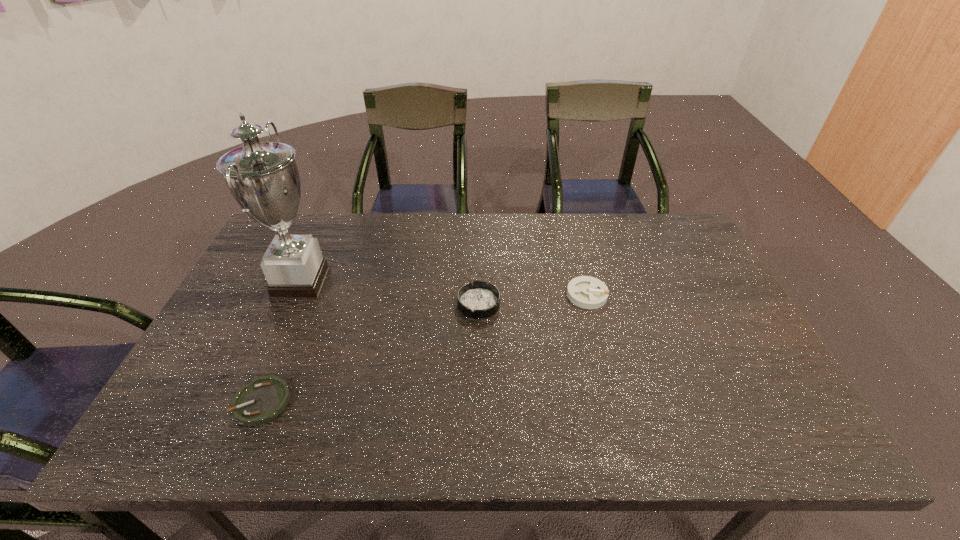
You are a GUI agent. You are given a task and a screenshot of the screen. Output one action in this format:
    pyautogui.click(x=<x>, y=<y>)
    Task: Click on the object positioned at the near edge
    
    Given the screenshot: What is the action you would take?
    pyautogui.click(x=262, y=400)

Where is `trophy cup located in the left edge section of the desktop`? Image resolution: width=960 pixels, height=540 pixels. trophy cup located in the left edge section of the desktop is located at coordinates (263, 178).

I want to click on ashtray at the left edge, so click(262, 400).

Where is `object located at the far left corner`? object located at the far left corner is located at coordinates (263, 178).

Find the location of a particular element. This screenshot has width=960, height=540. object situated at the near left corner is located at coordinates click(262, 400).

In the image, there is a desktop. Where is `vacant space at the far edge`? The height and width of the screenshot is (540, 960). vacant space at the far edge is located at coordinates (394, 222).

Where is `vacant space at the near edge of the desktop`? vacant space at the near edge of the desktop is located at coordinates (528, 413).

This screenshot has height=540, width=960. Find the location of `vacant space at the left edge of the desktop`. vacant space at the left edge of the desktop is located at coordinates (226, 410).

This screenshot has height=540, width=960. Find the location of `free space at the near right corner`. free space at the near right corner is located at coordinates (727, 417).

Where is `vacant area that lies between the second ashtray from left to right and the rightmost object`? This screenshot has width=960, height=540. vacant area that lies between the second ashtray from left to right and the rightmost object is located at coordinates (533, 299).